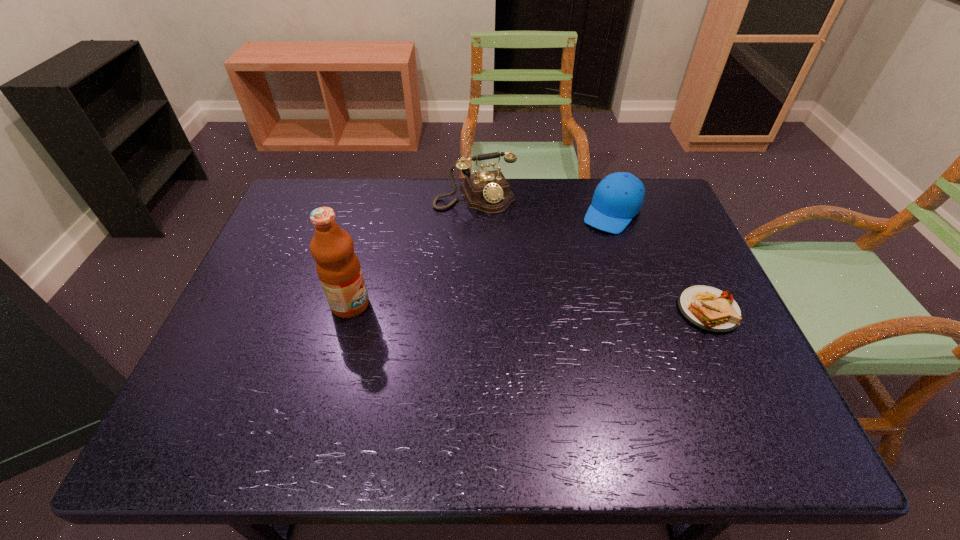
Locate an element on the screen. vacant space on the desktop that is between the tallest object and the sandwich and is positioned on the front-facing side of the third tallest object is located at coordinates (543, 308).

The image size is (960, 540). Find the location of `free space on the desktop that is between the leftmost object and the shortest object and is positioned on the dial of the telephone`. free space on the desktop that is between the leftmost object and the shortest object and is positioned on the dial of the telephone is located at coordinates (529, 307).